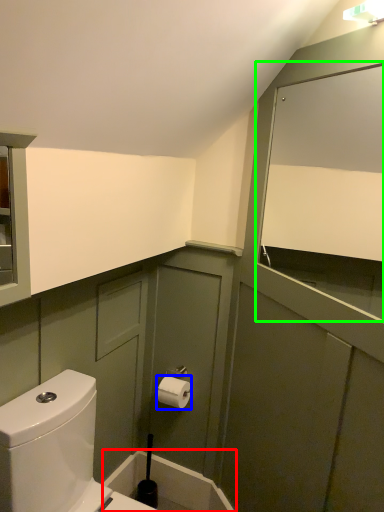
Question: Considering the real-world distances, which object is closest to bath (highlighted by a red box)? toiletry (highlighted by a blue box) or mirror (highlighted by a green box).

Choices:
 (A) toiletry
 (B) mirror

Answer: (A)